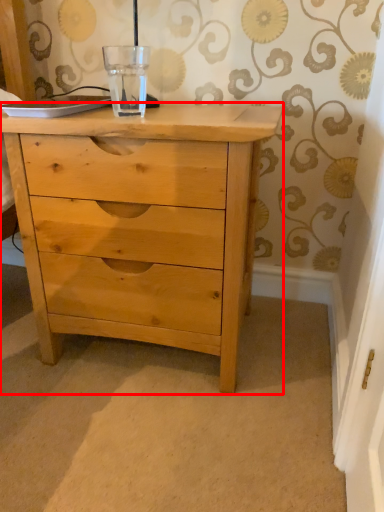
Question: From the image's perspective, what is the correct spatial positioning of chest of drawers (annotated by the red box) in reference to glass vase?

Choices:
 (A) above
 (B) below

Answer: (B)